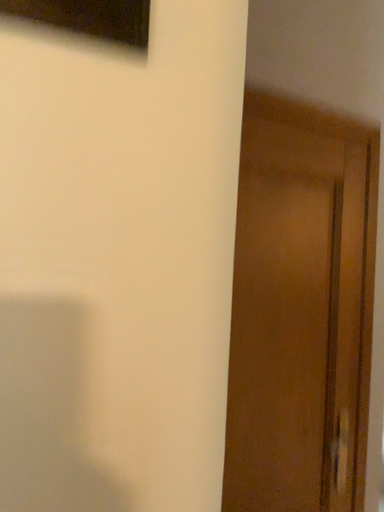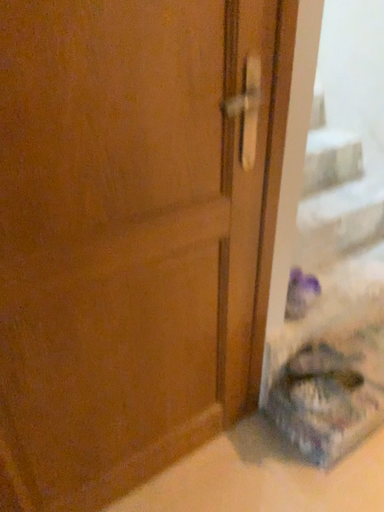
Question: How did the camera likely rotate when shooting the video?

Choices:
 (A) rotated upward
 (B) rotated downward

Answer: (B)